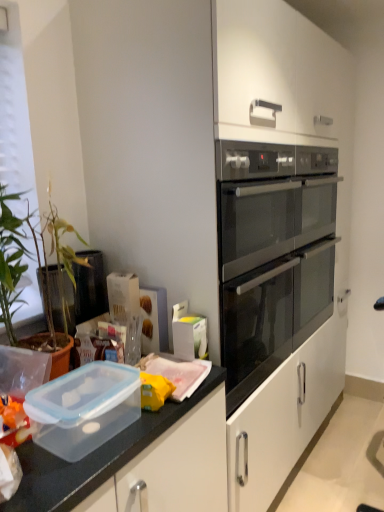
What do you see at coordinates (85, 408) in the screenshot?
I see `transparent plastic container at lower left` at bounding box center [85, 408].

This screenshot has height=512, width=384. Find the location of `transparent plastic container at lower left`. transparent plastic container at lower left is located at coordinates (85, 408).

Identify the location of satin black oven at center right. (272, 254).

Measure the distance between satin black oven at center right and camera.

satin black oven at center right is 1.26 meters away from camera.

What do you see at coordinates (272, 254) in the screenshot?
I see `satin black oven at center right` at bounding box center [272, 254].

Where is `transparent plastic container at lower left`? This screenshot has width=384, height=512. transparent plastic container at lower left is located at coordinates (85, 408).

Does transparent plastic container at lower left appear on the left side of satin black oven at center right?

Yes.

Who is more distant, transparent plastic container at lower left or satin black oven at center right?

satin black oven at center right is behind.

Does point (115, 405) come closer to viewer compared to point (332, 258)?

Yes.

Looking at this image, from the image's perspective, which one is positioned higher, transparent plastic container at lower left or satin black oven at center right?

satin black oven at center right appears higher in the image.

From a real-world perspective, is transparent plastic container at lower left physically below satin black oven at center right?

Yes, from a real-world perspective, transparent plastic container at lower left is beneath satin black oven at center right.

Considering the sizes of transparent plastic container at lower left and satin black oven at center right in the image, is transparent plastic container at lower left wider or thinner than satin black oven at center right?

transparent plastic container at lower left is thinner than satin black oven at center right.

Considering the relative sizes of transparent plastic container at lower left and satin black oven at center right in the image provided, is transparent plastic container at lower left taller than satin black oven at center right?

No, transparent plastic container at lower left is not taller than satin black oven at center right.

Considering the sizes of objects transparent plastic container at lower left and satin black oven at center right in the image provided, who is bigger, transparent plastic container at lower left or satin black oven at center right?

With larger size is satin black oven at center right.

Is transparent plastic container at lower left outside of satin black oven at center right?

Yes, transparent plastic container at lower left is located beyond the bounds of satin black oven at center right.

Is transparent plastic container at lower left in contact with satin black oven at center right?

transparent plastic container at lower left and satin black oven at center right are clearly separated.

Is transparent plastic container at lower left looking in the opposite direction of satin black oven at center right?

No, transparent plastic container at lower left's orientation is not away from satin black oven at center right.

How different are the orientations of transparent plastic container at lower left and satin black oven at center right in degrees?

There is a 0.356-degree angle between the facing directions of transparent plastic container at lower left and satin black oven at center right.

How distant is transparent plastic container at lower left from satin black oven at center right?

transparent plastic container at lower left and satin black oven at center right are 92.69 centimeters apart from each other.

This screenshot has height=512, width=384. What are the coordinates of `appliance beneath the satin black oven at center right (from a real-world perspective)` in the screenshot? It's located at (85, 408).

Considering the positions of objects satin black oven at center right and transparent plastic container at lower left in the image provided, who is more to the right, satin black oven at center right or transparent plastic container at lower left?

Positioned to the right is satin black oven at center right.

Is satin black oven at center right closer to the viewer compared to transparent plastic container at lower left?

No, satin black oven at center right is further to the viewer.

Which is nearer, (242,344) or (66,436)?

The point (66,436) is closer to the camera.

From the image's perspective, which one is positioned higher, satin black oven at center right or transparent plastic container at lower left?

satin black oven at center right appears higher in the image.

From a real-world perspective, is satin black oven at center right beneath transparent plastic container at lower left?

No.

Which object is wider, satin black oven at center right or transparent plastic container at lower left?

Wider between the two is satin black oven at center right.

Based on the photo, from their relative heights in the image, would you say satin black oven at center right is taller or shorter than transparent plastic container at lower left?

Clearly, satin black oven at center right is taller compared to transparent plastic container at lower left.

Considering the sizes of objects satin black oven at center right and transparent plastic container at lower left in the image provided, who is smaller, satin black oven at center right or transparent plastic container at lower left?

transparent plastic container at lower left.

Is transparent plastic container at lower left a part of satin black oven at center right?

No, transparent plastic container at lower left is located outside of satin black oven at center right.

Are satin black oven at center right and transparent plastic container at lower left making contact?

No, satin black oven at center right is not with transparent plastic container at lower left.

Is satin black oven at center right looking in the opposite direction of transparent plastic container at lower left?

No, satin black oven at center right's orientation is not away from transparent plastic container at lower left.

Based on the photo, what's the angular difference between satin black oven at center right and transparent plastic container at lower left's facing directions?

They differ by 0.356 degrees in their facing directions.

Identify the location of oven behind the transparent plastic container at lower left. This screenshot has width=384, height=512. (272, 254).

Where is `appliance below the satin black oven at center right (from the image's perspective)`? The image size is (384, 512). appliance below the satin black oven at center right (from the image's perspective) is located at coordinates (85, 408).

Find the location of a particular element. oven above the transparent plastic container at lower left (from a real-world perspective) is located at coordinates (272, 254).